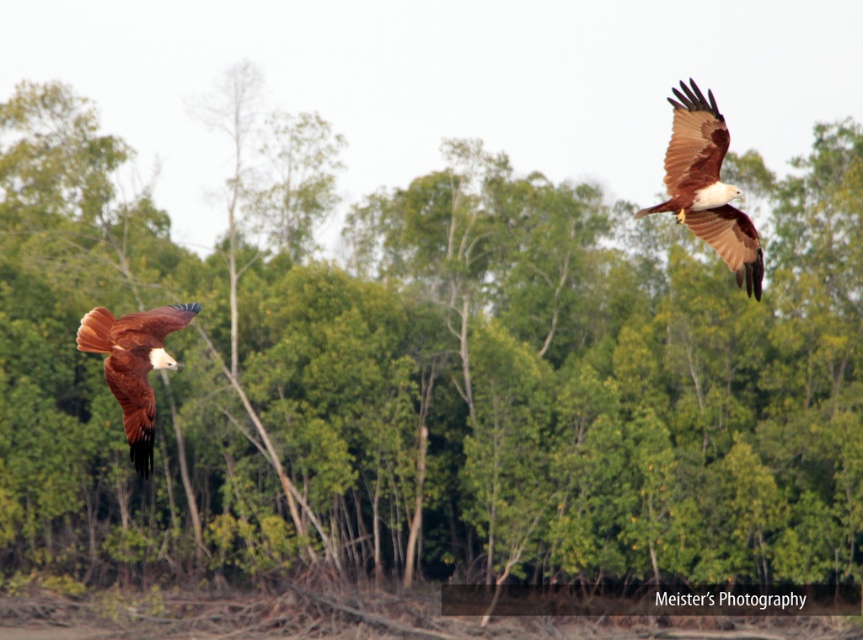
Question: Is brown feathered eagle at upper right wider than rusty brown feathers at left?

Choices:
 (A) yes
 (B) no

Answer: (A)

Question: Among these objects, which one is farthest from the camera?

Choices:
 (A) brown feathered eagle at upper right
 (B) rusty brown feathers at left

Answer: (A)

Question: Is brown feathered eagle at upper right positioned in front of rusty brown feathers at left?

Choices:
 (A) yes
 (B) no

Answer: (B)

Question: Is brown feathered eagle at upper right bigger than rusty brown feathers at left?

Choices:
 (A) yes
 (B) no

Answer: (A)